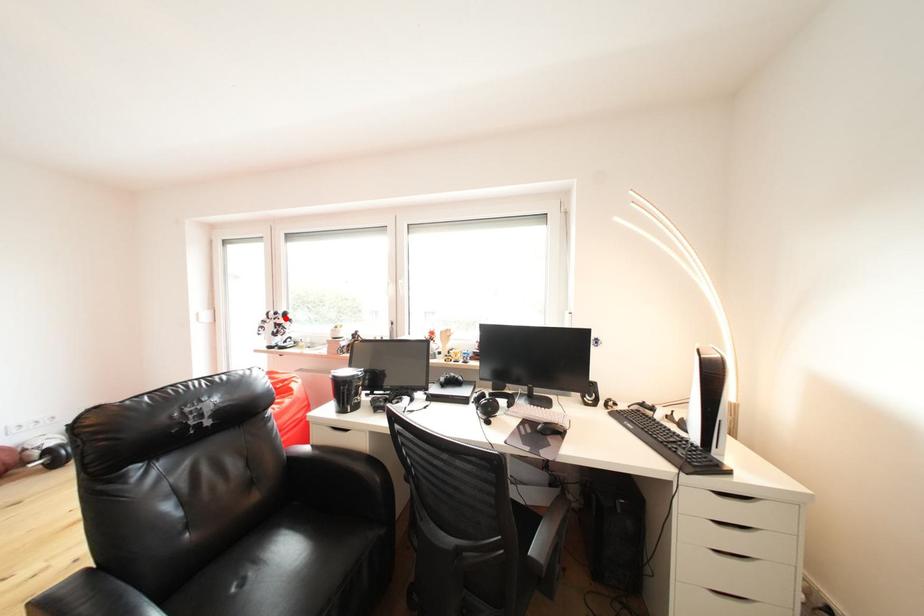
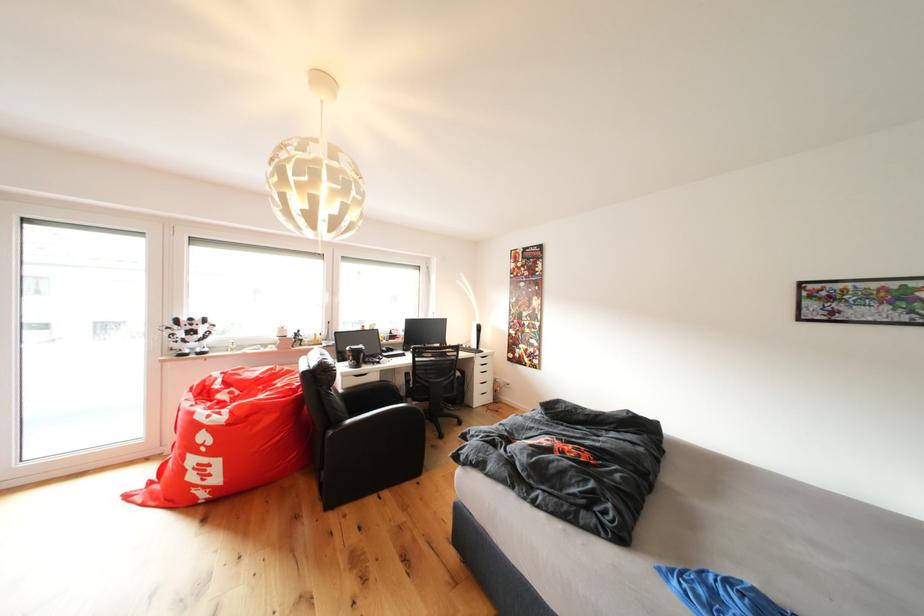
Question: I am providing you with two images of the same scene from different viewpoints. Given a red point in image1, look at the same physical point in image2. Is it:

Choices:
 (A) Closer to the viewpoint
 (B) Farther from the viewpoint

Answer: (B)